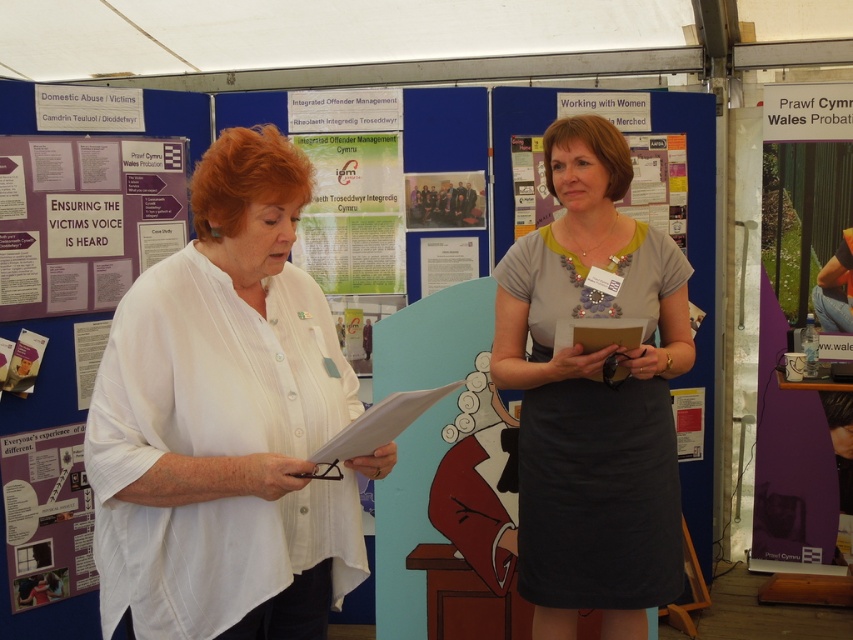
Is white matte shirt at center taller than purple paper at lower left?

Indeed, white matte shirt at center has a greater height compared to purple paper at lower left.

Measure the distance from white matte shirt at center to purple paper at lower left.

white matte shirt at center and purple paper at lower left are 4.47 feet apart.

Who is more distant from viewer, [279,436] or [15,592]?

Point [15,592]

You are a GUI agent. You are given a task and a screenshot of the screen. Output one action in this format:
    pyautogui.click(x=<x>, y=<y>)
    Task: Click on the white matte shirt at center
    This screenshot has width=853, height=640.
    Given the screenshot: What is the action you would take?
    pyautogui.click(x=227, y=420)

Can you confirm if white matte shirt at center is bigger than purple paper poster at upper left?

Yes, white matte shirt at center is bigger than purple paper poster at upper left.

Which is more to the right, white matte shirt at center or purple paper poster at upper left?

Positioned to the right is white matte shirt at center.

Find the location of `white matte shirt at center`. white matte shirt at center is located at coordinates (227, 420).

Describe the element at coordinates (593, 396) in the screenshot. The height and width of the screenshot is (640, 853). I see `matte gray dress at center` at that location.

Who is higher up, matte gray dress at center or purple paper at lower left?

matte gray dress at center is higher up.

This screenshot has width=853, height=640. I want to click on matte gray dress at center, so click(x=593, y=396).